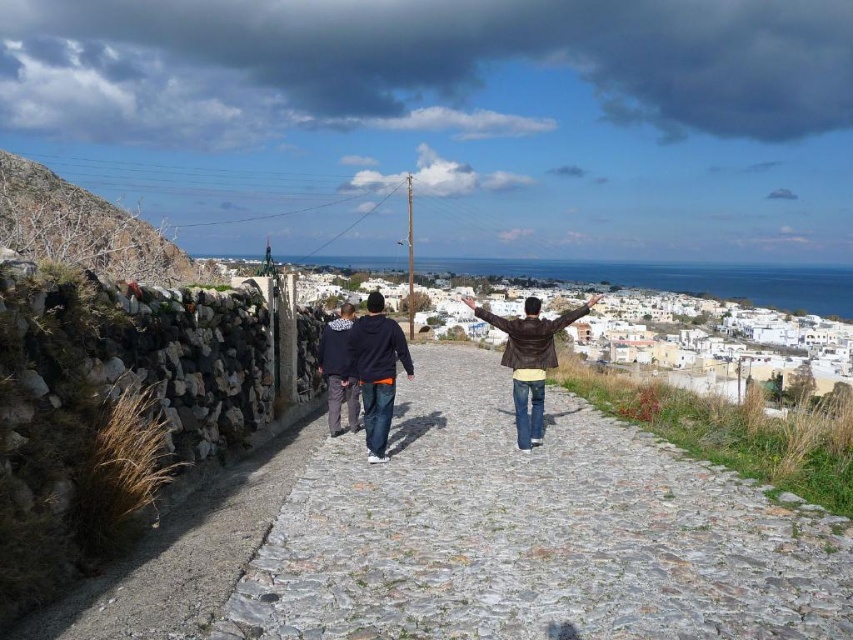
You are standing on the gray cobblestone path at center and want to reach the brown leather jacket at center. Which direction should you move to get closer to the jacket?

Result: The gray cobblestone path at center is positioned under the brown leather jacket at center, so you should move upward to reach the jacket.

You are standing at the top of the coastal town view and want to place a bench between the two points, point (235, 609) and point (396, 353). Which point should the bench be closer to if you want it to be nearer to the foreground?

The bench should be placed closer to point (235, 609) because it is closer to the viewer than point (396, 353), so it will be nearer to the foreground.

You are a delivery drone carrying a package that requires a 20 feet wide open space to land safely. You are currently above the gray cobblestone path at center and the brown leather jacket at center. Can you land safely between them?

The gray cobblestone path at center and brown leather jacket at center are 21.94 feet apart, which is more than the required 20 feet. Therefore, you can safely land between them.